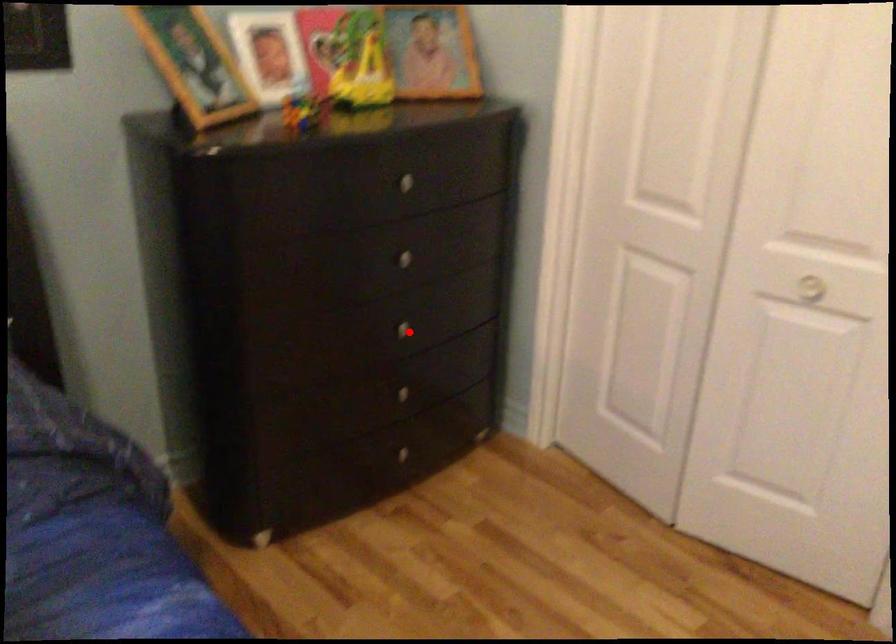
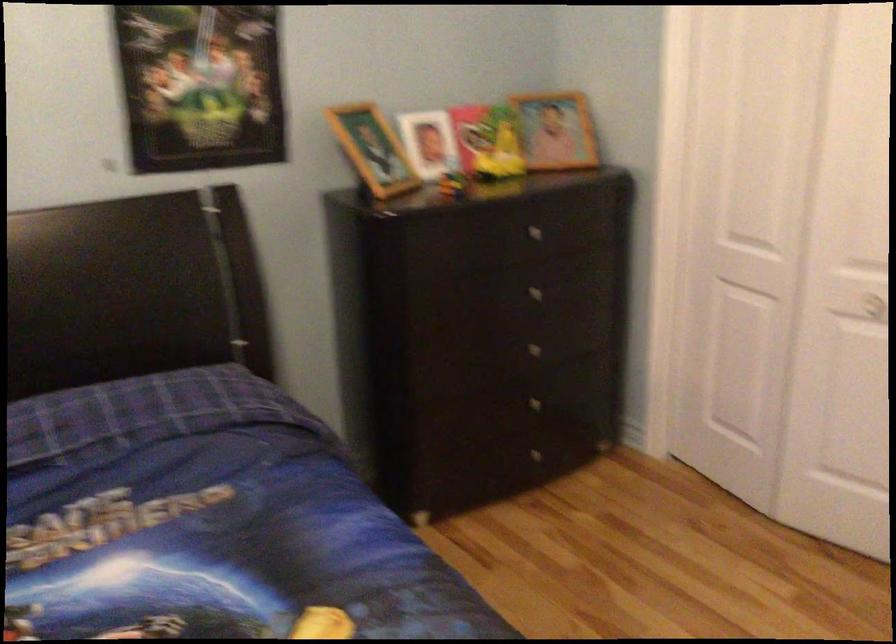
Question: I am providing you with two images of the same scene from different viewpoints. In image1, a red point is highlighted. Considering the same 3D point in image2, which of the following is correct?

Choices:
 (A) It is closer
 (B) It is farther

Answer: (B)